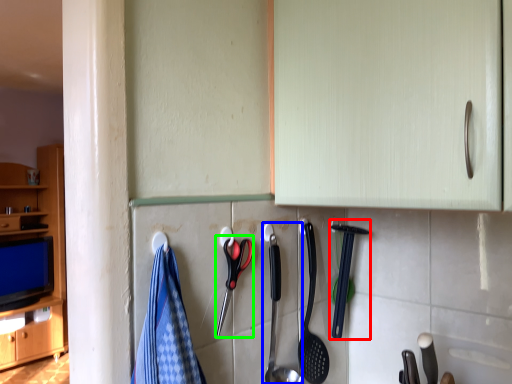
Question: Estimate the real-world distances between objects in this image. Which object is closer to silverware (highlighted by a red box), silverware (highlighted by a blue box) or scissors (highlighted by a green box)?

Choices:
 (A) silverware
 (B) scissors

Answer: (A)